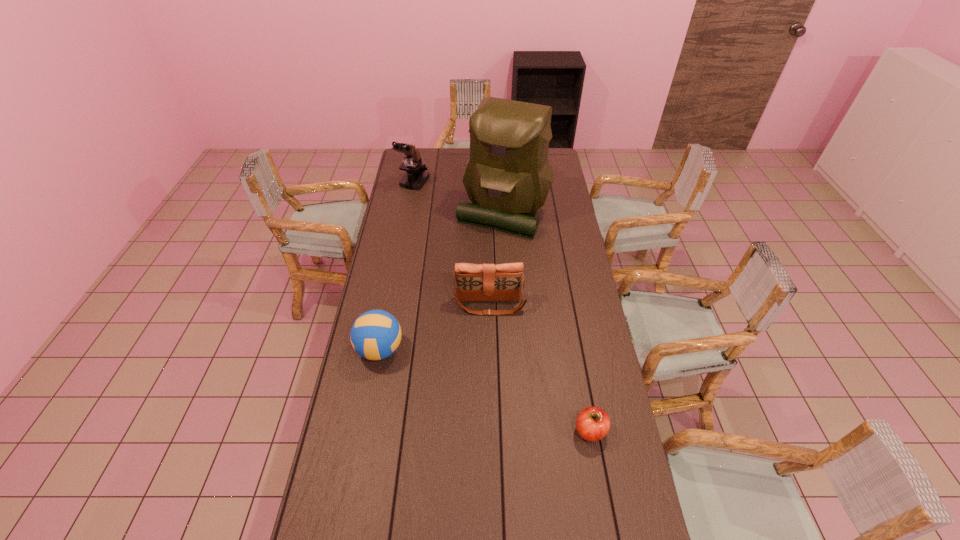
Locate an element on the screen. vacant space located on the left of the apple is located at coordinates coord(527,431).

Where is `microscope situated at the left edge`? Image resolution: width=960 pixels, height=540 pixels. microscope situated at the left edge is located at coordinates coord(416,176).

The width and height of the screenshot is (960, 540). What are the coordinates of `volleyball at the left edge` in the screenshot? It's located at (376, 334).

Locate an element on the screen. The image size is (960, 540). backpack that is at the right edge is located at coordinates point(508,176).

Identify the location of apple that is at the right edge. (593, 423).

This screenshot has width=960, height=540. In order to click on vacant space at the far edge in this screenshot , I will do `click(436, 148)`.

In the image, there is a desktop. Where is `vacant space at the left edge`? The width and height of the screenshot is (960, 540). vacant space at the left edge is located at coordinates (418, 240).

In the image, there is a desktop. At what (x,y) coordinates should I click in order to perform the action: click on vacant area at the right edge. Please return your answer as a coordinate pair (x, y). Looking at the image, I should click on (562, 184).

In order to click on empty location between the fourth farthest object and the backpack in this screenshot , I will do `click(442, 280)`.

You are a GUI agent. You are given a task and a screenshot of the screen. Output one action in this format:
    pyautogui.click(x=<x>, y=<y>)
    Task: Click on the blank region between the volleyball and the nearest object
    The width and height of the screenshot is (960, 540).
    Given the screenshot: What is the action you would take?
    pyautogui.click(x=485, y=390)